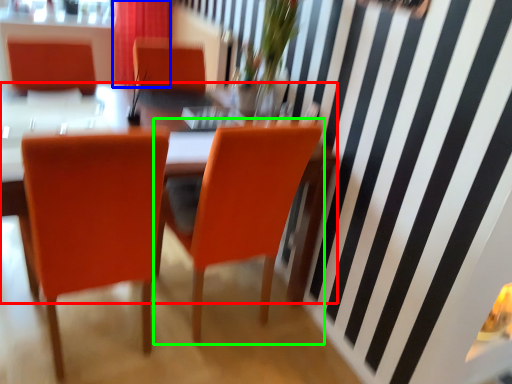
Question: Which object is the closest to the table (highlighted by a red box)? Choose among these: curtain (highlighted by a blue box) or chair (highlighted by a green box).

Choices:
 (A) curtain
 (B) chair

Answer: (B)